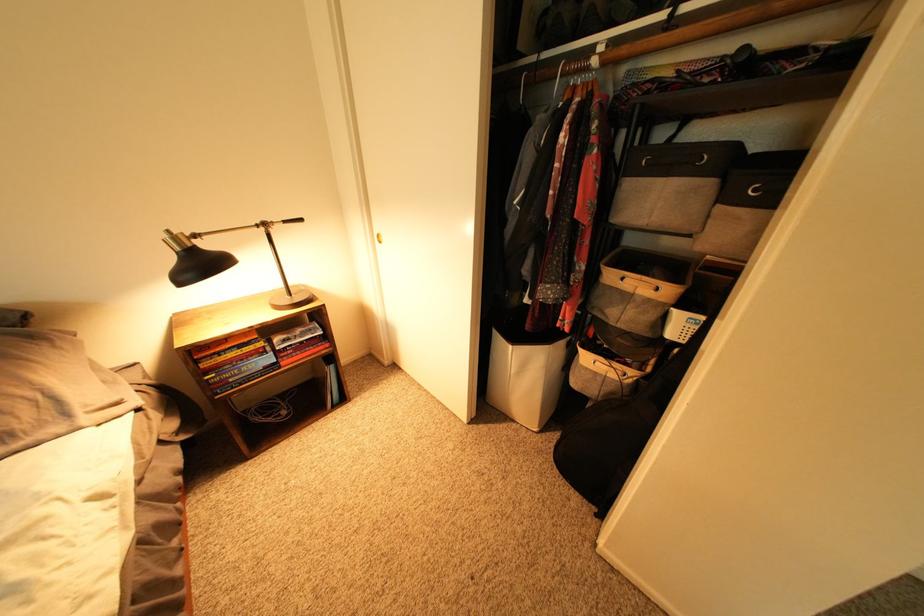
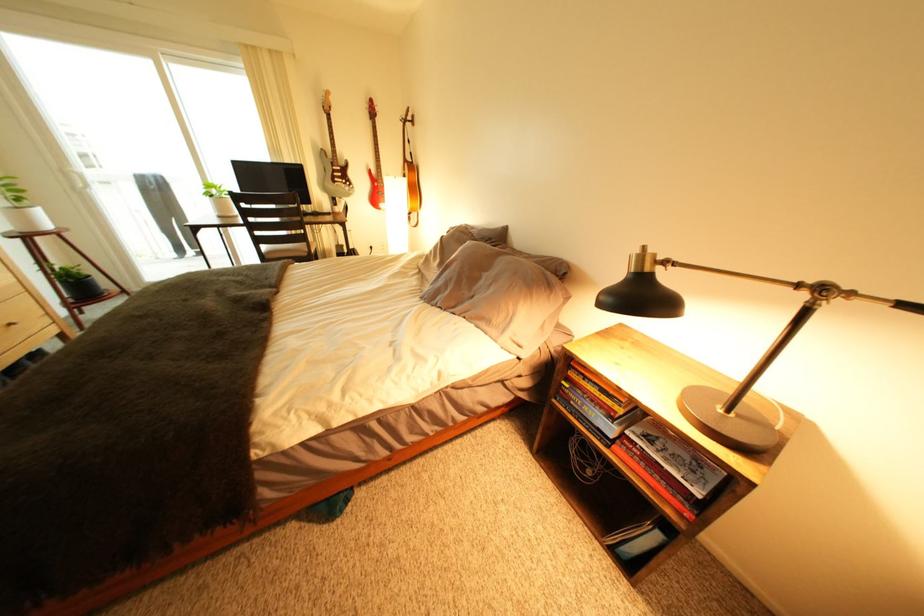
Locate, in the second image, the point that corresponds to the point at 334,334 in the first image.

(712, 496)